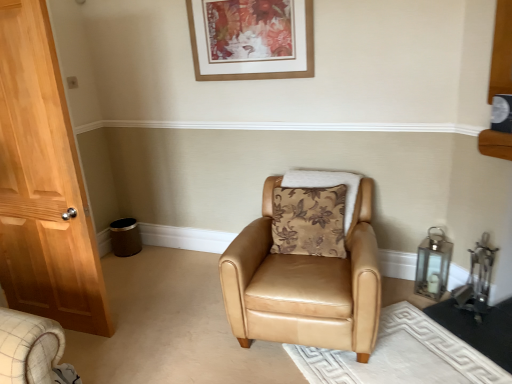
Question: Is the depth of tan leather armchair at center less than that of brown floral fabric pillow at center?

Choices:
 (A) yes
 (B) no

Answer: (A)

Question: Does tan leather armchair at center have a smaller size compared to brown floral fabric pillow at center?

Choices:
 (A) no
 (B) yes

Answer: (A)

Question: Is tan leather armchair at center not within brown floral fabric pillow at center?

Choices:
 (A) no
 (B) yes

Answer: (B)

Question: Could you tell me if tan leather armchair at center is facing brown floral fabric pillow at center?

Choices:
 (A) no
 (B) yes

Answer: (A)

Question: Is brown floral fabric pillow at center completely or partially inside tan leather armchair at center?

Choices:
 (A) yes
 (B) no

Answer: (A)

Question: Considering the positions of brown floral fabric pillow at center and tan leather armchair at center in the image, is brown floral fabric pillow at center taller or shorter than tan leather armchair at center?

Choices:
 (A) tall
 (B) short

Answer: (B)

Question: Considering the positions of point (353, 183) and point (264, 266), is point (353, 183) closer or farther from the camera than point (264, 266)?

Choices:
 (A) farther
 (B) closer

Answer: (A)

Question: Considering their positions, is brown floral fabric pillow at center located in front of or behind tan leather armchair at center?

Choices:
 (A) front
 (B) behind

Answer: (B)

Question: In terms of width, does brown floral fabric pillow at center look wider or thinner when compared to tan leather armchair at center?

Choices:
 (A) wide
 (B) thin

Answer: (B)

Question: Would you say tan leather armchair at center is inside or outside brown floral fabric pillow at center?

Choices:
 (A) outside
 (B) inside

Answer: (A)

Question: Does point (222, 273) appear closer or farther from the camera than point (350, 223)?

Choices:
 (A) farther
 (B) closer

Answer: (B)

Question: Is tan leather armchair at center in front of or behind brown floral fabric pillow at center in the image?

Choices:
 (A) behind
 (B) front

Answer: (B)

Question: Is tan leather armchair at center bigger or smaller than brown floral fabric pillow at center?

Choices:
 (A) big
 (B) small

Answer: (A)

Question: Considering their positions, is brown floral fabric pillow at center located in front of or behind wooden picture frame at upper center?

Choices:
 (A) front
 (B) behind

Answer: (A)

Question: From a real-world perspective, is brown floral fabric pillow at center positioned above or below wooden picture frame at upper center?

Choices:
 (A) above
 (B) below

Answer: (B)